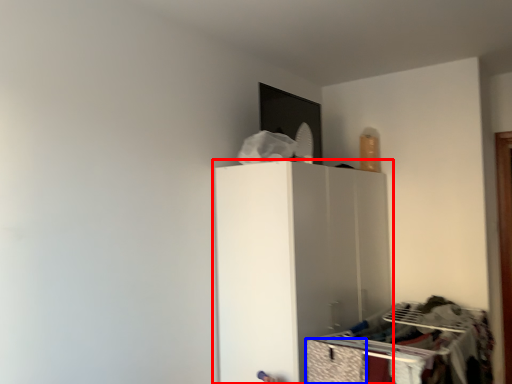
Question: Which of the following is the closest to the observer, furniture (highlighted by a red box) or drawer (highlighted by a blue box)?

Choices:
 (A) furniture
 (B) drawer

Answer: (B)